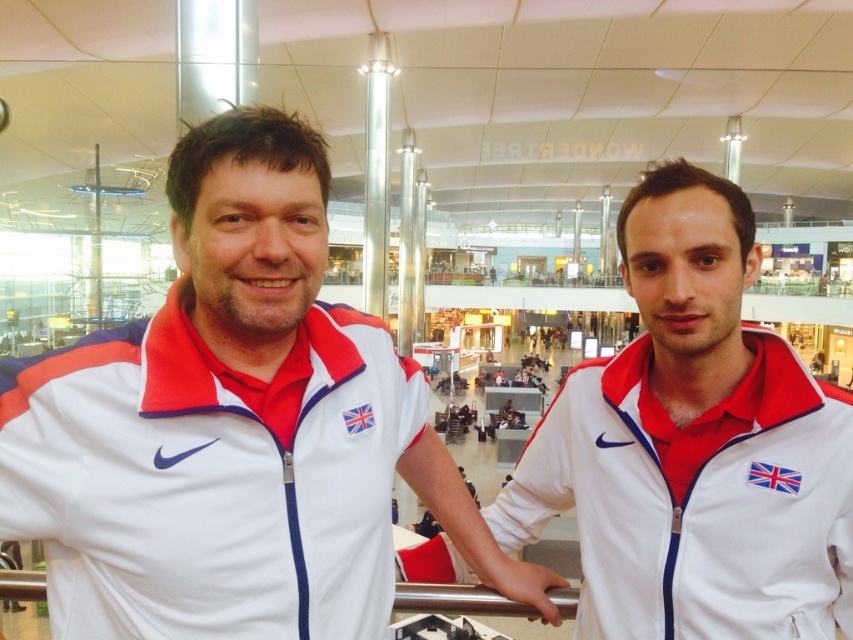
From the picture: Who is taller, white fabric jacket at left or white fabric jacket at center?

With more height is white fabric jacket at left.

Does white fabric jacket at left have a greater height compared to white fabric jacket at center?

Indeed, white fabric jacket at left has a greater height compared to white fabric jacket at center.

Find the location of a particular element. white fabric jacket at left is located at coordinates (234, 428).